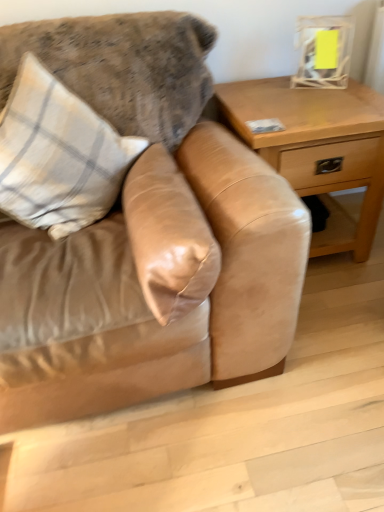
Question: Does suede couch at center have a greater height compared to light brown wood table at right?

Choices:
 (A) no
 (B) yes

Answer: (B)

Question: From a real-world perspective, is suede couch at center located beneath light brown wood table at right?

Choices:
 (A) no
 (B) yes

Answer: (A)

Question: Can we say suede couch at center lies outside light brown wood table at right?

Choices:
 (A) no
 (B) yes

Answer: (B)

Question: From the image's perspective, does suede couch at center appear higher than light brown wood table at right?

Choices:
 (A) yes
 (B) no

Answer: (B)

Question: From the image's perspective, is suede couch at center located beneath light brown wood table at right?

Choices:
 (A) yes
 (B) no

Answer: (A)

Question: From the image's perspective, is plaid fabric pillow at upper left, positioned as the 2th pillow in right-to-left order, located above or below suede couch at center?

Choices:
 (A) below
 (B) above

Answer: (B)

Question: Considering the positions of plaid fabric pillow at upper left, positioned as the 2th pillow in right-to-left order, and suede couch at center in the image, is plaid fabric pillow at upper left, positioned as the 2th pillow in right-to-left order, wider or thinner than suede couch at center?

Choices:
 (A) thin
 (B) wide

Answer: (A)

Question: Which is correct: plaid fabric pillow at upper left, the first pillow viewed from the left, is inside suede couch at center, or outside of it?

Choices:
 (A) outside
 (B) inside

Answer: (B)

Question: Looking at the image, does plaid fabric pillow at upper left, the first pillow viewed from the left, seem bigger or smaller compared to suede couch at center?

Choices:
 (A) big
 (B) small

Answer: (B)

Question: Considering the positions of suede pillow at center, which ranks as the 1th pillow in right-to-left order, and plaid fabric pillow at upper left, the first pillow viewed from the left, in the image, is suede pillow at center, which ranks as the 1th pillow in right-to-left order, bigger or smaller than plaid fabric pillow at upper left, the first pillow viewed from the left,?

Choices:
 (A) big
 (B) small

Answer: (B)

Question: In the image, is suede pillow at center, which is the 2th pillow from left to right, on the left side or the right side of plaid fabric pillow at upper left, the first pillow viewed from the left?

Choices:
 (A) left
 (B) right

Answer: (B)

Question: Considering the positions of point (193, 249) and point (4, 172), is point (193, 249) closer or farther from the camera than point (4, 172)?

Choices:
 (A) closer
 (B) farther

Answer: (A)

Question: Is suede pillow at center, which is the 2th pillow from left to right, inside or outside of plaid fabric pillow at upper left, the first pillow viewed from the left?

Choices:
 (A) inside
 (B) outside

Answer: (B)

Question: Based on their sizes in the image, would you say suede pillow at center, which is the 2th pillow from left to right, is bigger or smaller than light brown wood table at right?

Choices:
 (A) big
 (B) small

Answer: (B)

Question: Is suede pillow at center, which is the 2th pillow from left to right, spatially inside light brown wood table at right, or outside of it?

Choices:
 (A) inside
 (B) outside

Answer: (B)